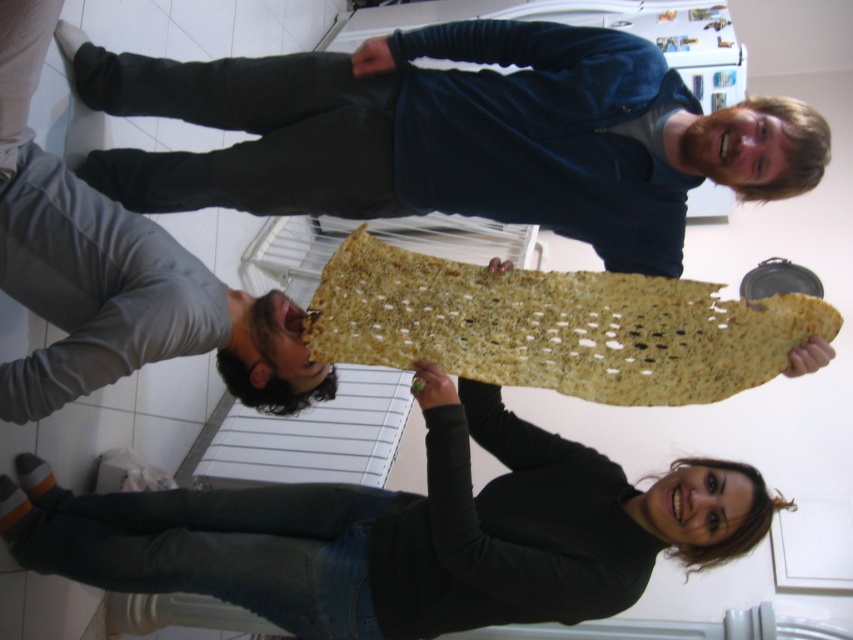
From the picture: You are a delivery person who needs to place a package on the floor. The package is 1 meter wide. You see the matte yellow fabric at center and the gray matte pants at lower left. Can you fit the package between them?

The matte yellow fabric at center might be wider than gray matte pants at lower left, so the package may or may not fit depending on the exact width of the matte yellow fabric at center.

You are standing in the kitchen scene and want to reach both points. Which point, point (x=581, y=177) or point (x=51, y=360), will you reach first?

Point (x=581, y=177) is further to the viewer than point (x=51, y=360), so you will reach point (x=581, y=177) first.

You are trying to hang a picture frame that requires 10 cm of vertical space. You see the knitted fabric at upper center and the golden textured matzah at center. Which object provides enough vertical space for the frame?

The knitted fabric at upper center has a greater height compared to the golden textured matzah at center, so it can provide the required 10 cm vertical space for the picture frame.